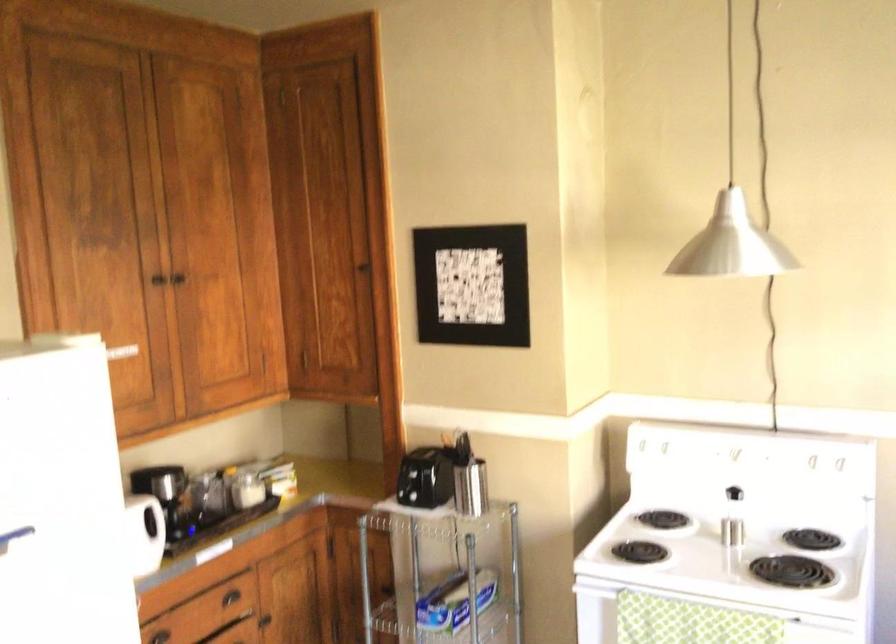
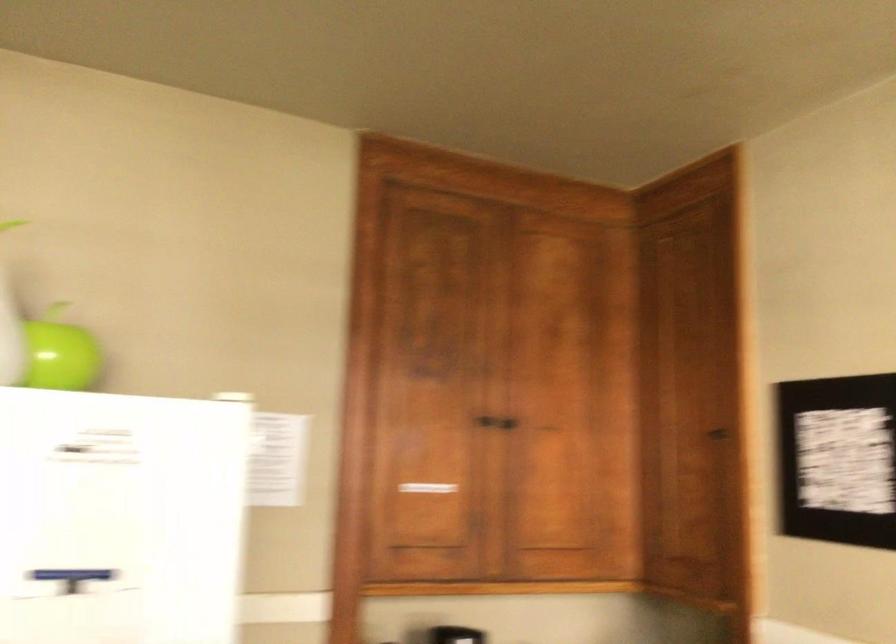
The point at [164,275] is marked in the first image. Where is the corresponding point in the second image?

(485, 420)